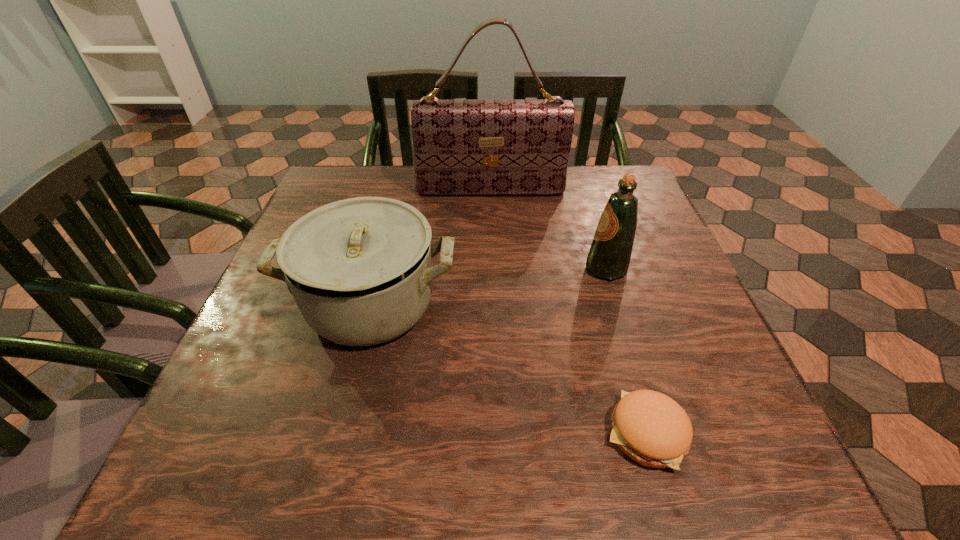
Where is `free location located on the back of the second shortest object`? This screenshot has height=540, width=960. free location located on the back of the second shortest object is located at coordinates (397, 197).

Locate an element on the screen. This screenshot has width=960, height=540. vacant region located on the left of the patty is located at coordinates (544, 433).

Identify the location of object located at the far edge. This screenshot has height=540, width=960. (460, 147).

I want to click on object that is at the near edge, so (651, 428).

This screenshot has width=960, height=540. In order to click on object located at the left edge in this screenshot , I will do point(360,270).

Locate an element on the screen. The image size is (960, 540). olive oil present at the right edge is located at coordinates (609, 256).

At what (x,y) coordinates should I click in order to perform the action: click on patty at the right edge. Please return your answer as a coordinate pair (x, y). The width and height of the screenshot is (960, 540). Looking at the image, I should click on tap(651, 428).

This screenshot has width=960, height=540. I want to click on object present at the near right corner, so click(x=651, y=428).

Where is `free location at the far edge`? This screenshot has width=960, height=540. free location at the far edge is located at coordinates (580, 207).

In the image, there is a desktop. Find the location of `vacant space at the near edge`. vacant space at the near edge is located at coordinates tap(377, 431).